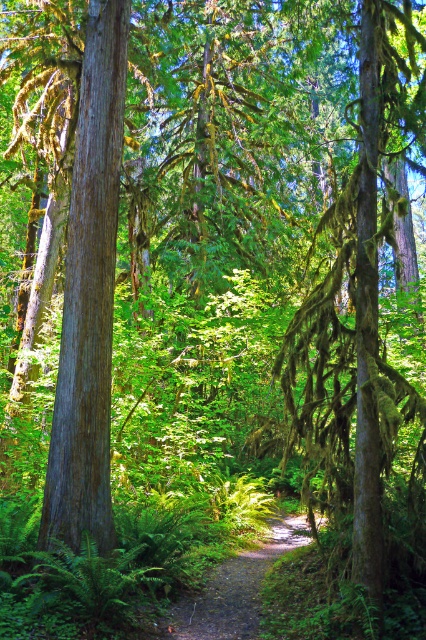
Does green mossy tree at center have a lesser height compared to dirt path at center?

In fact, green mossy tree at center may be taller than dirt path at center.

Is green mossy tree at center positioned in front of dirt path at center?

Yes.

Which is in front, point (396, 564) or point (322, 522)?

Point (396, 564)

Where is `green mossy tree at center`? This screenshot has height=640, width=426. green mossy tree at center is located at coordinates (362, 376).